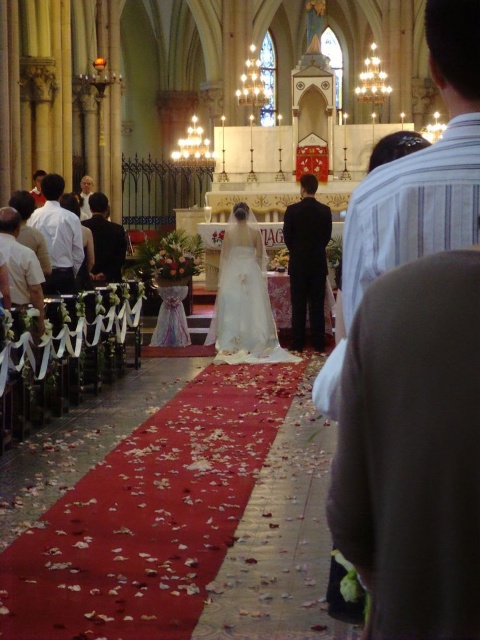
Question: Is black satin suit at center to the right of light brown shirt at left from the viewer's perspective?

Choices:
 (A) no
 (B) yes

Answer: (B)

Question: Is black satin suit at center bigger than light brown shirt at left?

Choices:
 (A) yes
 (B) no

Answer: (A)

Question: Is white satin dress at left bigger than light brown shirt at left?

Choices:
 (A) no
 (B) yes

Answer: (B)

Question: Which object is closer to the camera taking this photo?

Choices:
 (A) black matte suit at left
 (B) light brown shirt at left
 (C) white satin dress at center
 (D) white cotton shirt at left

Answer: (D)

Question: Which of these objects is positioned closest to the white satin dress at center?

Choices:
 (A) white satin dress at left
 (B) light brown shirt at left
 (C) white cotton shirt at left
 (D) black satin suit at center

Answer: (D)

Question: Which point is closer to the camera?

Choices:
 (A) (51, 241)
 (B) (108, 236)
 (C) (298, 344)

Answer: (A)